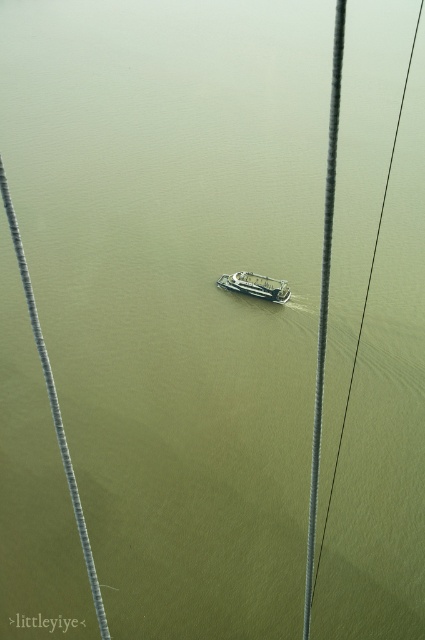
Question: Which point is farther to the camera?

Choices:
 (A) (325, 212)
 (B) (226, 284)

Answer: (B)

Question: Does metallic wire at center come in front of green metallic boat at center?

Choices:
 (A) yes
 (B) no

Answer: (A)

Question: Which point is farther to the camera?

Choices:
 (A) metallic wire at center
 (B) metallic gray cable at center

Answer: (A)

Question: Which object is the farthest from the metallic gray cable at center?

Choices:
 (A) green metallic boat at center
 (B) metallic wire at center

Answer: (A)

Question: Is metallic gray cable at center thinner than metallic wire at center?

Choices:
 (A) no
 (B) yes

Answer: (B)

Question: Does metallic gray cable at center appear on the left side of metallic wire at center?

Choices:
 (A) no
 (B) yes

Answer: (B)